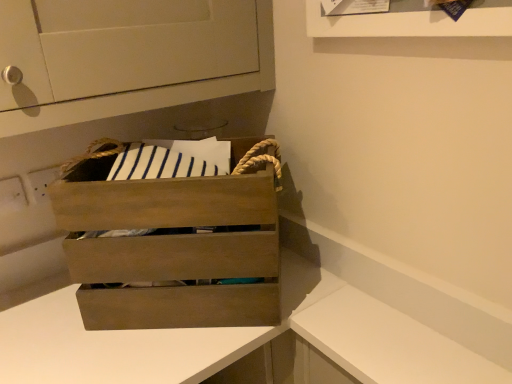
Question: Considering the relative sizes of wooden crate at center and wooden crate at center, the 1th counter in the left-to-right sequence, in the image provided, is wooden crate at center shorter than wooden crate at center, the 1th counter in the left-to-right sequence,?

Choices:
 (A) yes
 (B) no

Answer: (A)

Question: Does wooden crate at center contain wooden crate at center, which is the 2th counter in right-to-left order?

Choices:
 (A) no
 (B) yes

Answer: (A)

Question: Is wooden crate at center smaller than wooden crate at center, the 1th counter in the left-to-right sequence?

Choices:
 (A) yes
 (B) no

Answer: (A)

Question: Are wooden crate at center and wooden crate at center, the 1th counter in the left-to-right sequence, far apart?

Choices:
 (A) yes
 (B) no

Answer: (B)

Question: Is wooden crate at center to the left of wooden crate at center, which is the 2th counter in right-to-left order, from the viewer's perspective?

Choices:
 (A) no
 (B) yes

Answer: (A)

Question: Can you confirm if wooden crate at center is thinner than wooden crate at center, the 1th counter in the left-to-right sequence?

Choices:
 (A) no
 (B) yes

Answer: (B)

Question: Considering the relative positions of white matte counter at lower right, placed as the 2th counter when sorted from left to right, and wooden crate at center in the image provided, is white matte counter at lower right, placed as the 2th counter when sorted from left to right, to the right of wooden crate at center from the viewer's perspective?

Choices:
 (A) yes
 (B) no

Answer: (A)

Question: Are white matte counter at lower right, placed as the first counter when sorted from right to left, and wooden crate at center making contact?

Choices:
 (A) yes
 (B) no

Answer: (B)

Question: Is white matte counter at lower right, placed as the 2th counter when sorted from left to right, looking in the opposite direction of wooden crate at center?

Choices:
 (A) yes
 (B) no

Answer: (B)

Question: From a real-world perspective, does white matte counter at lower right, placed as the first counter when sorted from right to left, stand above wooden crate at center?

Choices:
 (A) yes
 (B) no

Answer: (B)

Question: Can you confirm if white matte counter at lower right, placed as the first counter when sorted from right to left, is bigger than wooden crate at center?

Choices:
 (A) no
 (B) yes

Answer: (B)

Question: Does white matte counter at lower right, placed as the 2th counter when sorted from left to right, have a lesser height compared to wooden crate at center?

Choices:
 (A) yes
 (B) no

Answer: (B)

Question: From the image's perspective, is wooden crate at center above white matte counter at lower right, placed as the first counter when sorted from right to left?

Choices:
 (A) no
 (B) yes

Answer: (B)